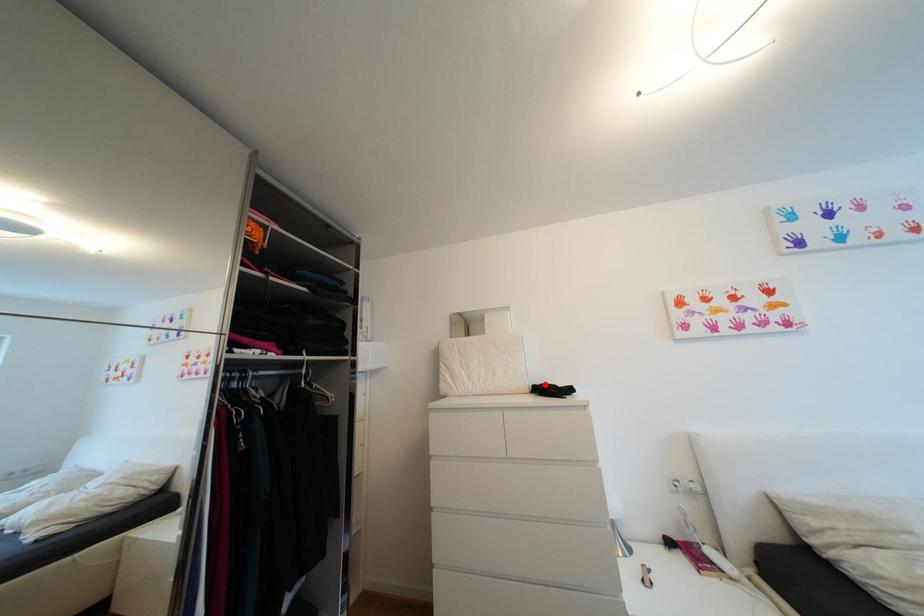
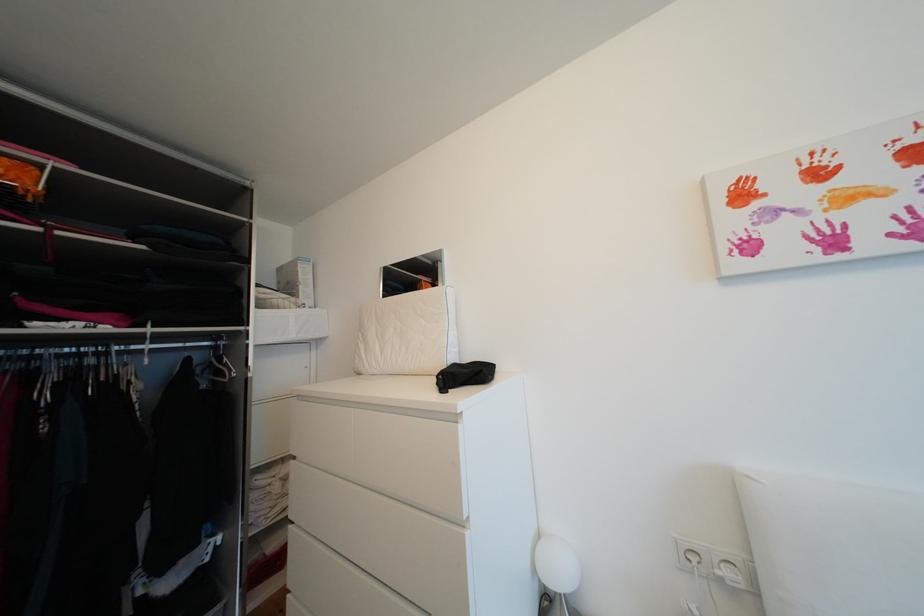
Locate, in the second image, the point that corresponds to the highlighted location in the first image.

(473, 362)